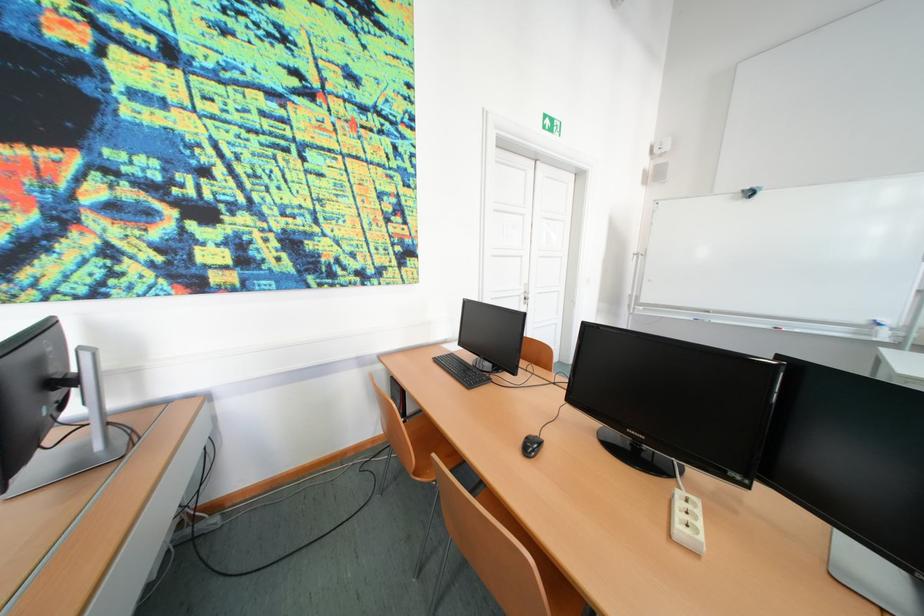
This screenshot has height=616, width=924. Describe the element at coordinates (526, 292) in the screenshot. I see `the metal door handle` at that location.